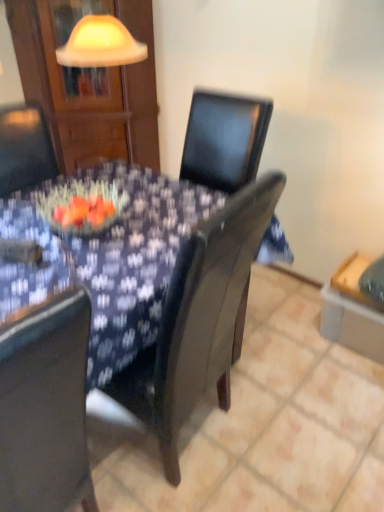
Measure the distance between matte black chair at center and camera.

They are 35.10 inches apart.

Identify the location of matte black chair at center. (199, 319).

Describe the element at coordinates (199, 319) in the screenshot. I see `matte black chair at center` at that location.

Find the location of `matte black chair at center`. matte black chair at center is located at coordinates (199, 319).